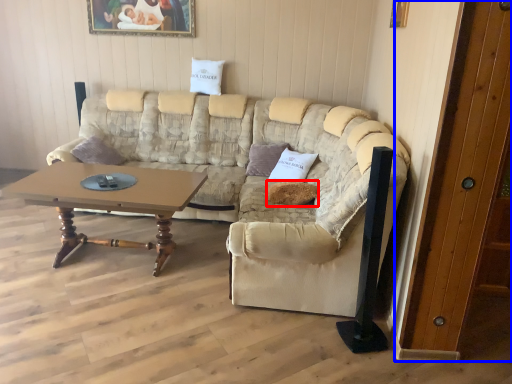
Question: Which of the following is the closest to the observer, pillow (highlighted by a red box) or door (highlighted by a blue box)?

Choices:
 (A) pillow
 (B) door

Answer: (B)